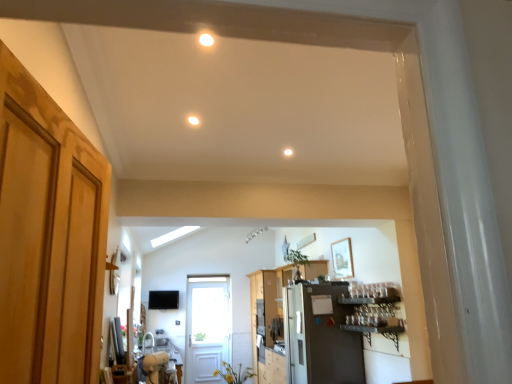
Question: Is light brown wood door at left, the 1th door viewed from the right, at the right side of white glossy table at lower center?

Choices:
 (A) yes
 (B) no

Answer: (A)

Question: Is the position of light brown wood door at left, the second door from the bottom, more distant than that of white glossy table at lower center?

Choices:
 (A) no
 (B) yes

Answer: (A)

Question: Can you confirm if light brown wood door at left, the second door from the bottom, is bigger than white glossy table at lower center?

Choices:
 (A) yes
 (B) no

Answer: (A)

Question: Is light brown wood door at left, the first door in the front-to-back sequence, in front of white glossy table at lower center?

Choices:
 (A) yes
 (B) no

Answer: (A)

Question: From the image's perspective, does light brown wood door at left, which is the 1th door from top to bottom, appear higher than white glossy table at lower center?

Choices:
 (A) no
 (B) yes

Answer: (B)

Question: Is light brown wood door at left, the 1th door viewed from the right, not inside white glossy table at lower center?

Choices:
 (A) yes
 (B) no

Answer: (A)

Question: Does white glossy sink at lower left appear on the right side of matte white light fixture at center, the third lighting viewed from the right?

Choices:
 (A) no
 (B) yes

Answer: (A)

Question: From a real-world perspective, is white glossy sink at lower left located higher than matte white light fixture at center, the third lighting viewed from the right?

Choices:
 (A) yes
 (B) no

Answer: (B)

Question: Does white glossy sink at lower left appear on the left side of matte white light fixture at center, the first lighting in the left-to-right sequence?

Choices:
 (A) no
 (B) yes

Answer: (B)

Question: Is white glossy sink at lower left turned away from matte white light fixture at center, positioned as the 2th lighting in bottom-to-top order?

Choices:
 (A) yes
 (B) no

Answer: (B)

Question: Is white glossy sink at lower left not inside matte white light fixture at center, which ranks as the second lighting in back-to-front order?

Choices:
 (A) no
 (B) yes

Answer: (B)

Question: Would you say matte white light fixture at center, arranged as the 2th lighting when viewed from the top, is part of white glossy sink at lower left's contents?

Choices:
 (A) yes
 (B) no

Answer: (B)

Question: Is metallic gray shelf at right to the right of white glossy sink at lower left from the viewer's perspective?

Choices:
 (A) no
 (B) yes

Answer: (B)